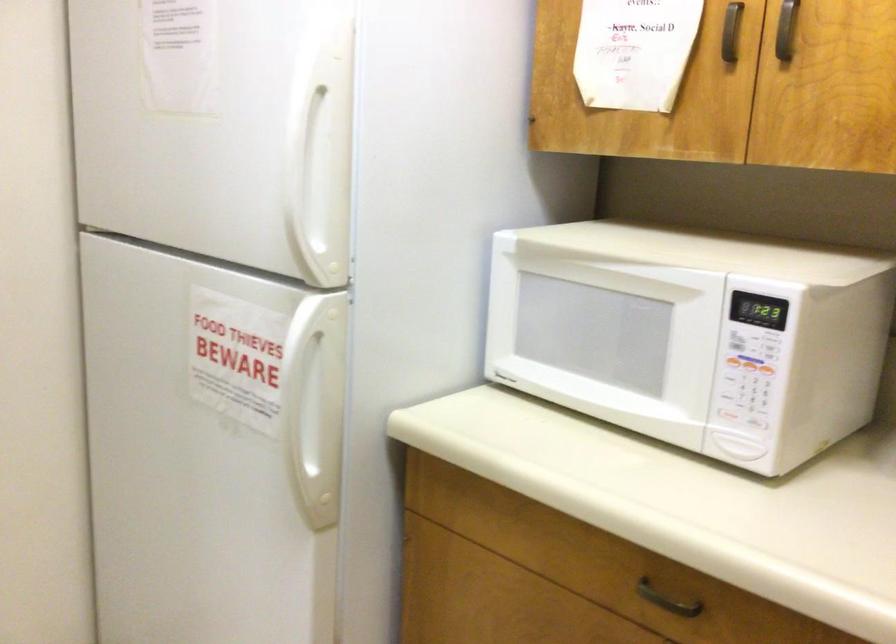
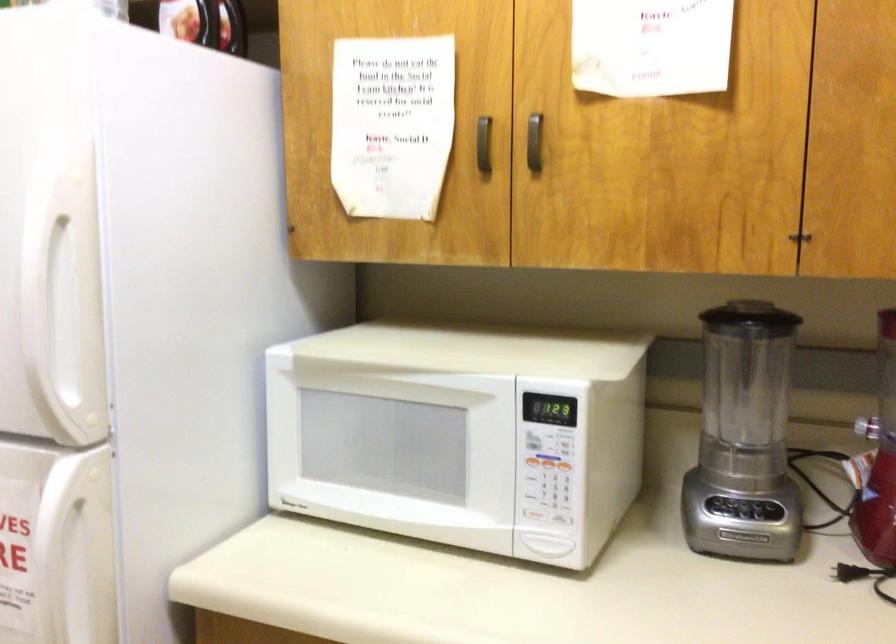
Find the pixel in the second image that matches point (756, 419) in the first image.

(563, 518)